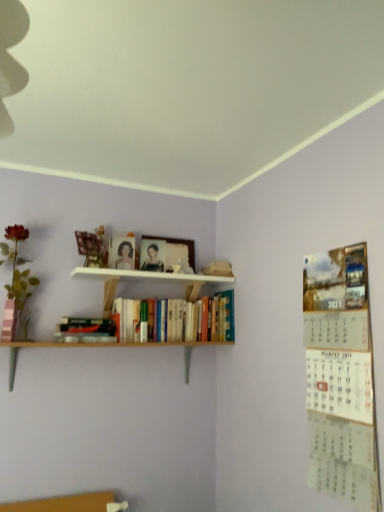
Measure the distance between metallic paper calendar at right and camera.

A distance of 1.25 meters exists between metallic paper calendar at right and camera.

Where is `metallic paper calendar at right`? The height and width of the screenshot is (512, 384). metallic paper calendar at right is located at coordinates (341, 376).

You are a GUI agent. You are given a task and a screenshot of the screen. Output one action in this format:
    pyautogui.click(x=<x>, y=<y>)
    Task: Click on the hardcover books at center, arranged as the 2th book when viewed from the left
    The image size is (384, 512).
    Given the screenshot: What is the action you would take?
    pyautogui.click(x=194, y=320)

Image resolution: width=384 pixels, height=512 pixels. What are the coordinates of `matte black portrait at center` in the screenshot? It's located at (153, 260).

Looking at this image, is wooden picture frame at upper center positioned with its back to matte black portrait at center?

No, wooden picture frame at upper center is not facing the opposite direction of matte black portrait at center.

How much distance is there between wooden picture frame at upper center and matte black portrait at center?

wooden picture frame at upper center is 5.78 inches from matte black portrait at center.

Choose the correct answer: Is wooden picture frame at upper center inside matte black portrait at center or outside it?

wooden picture frame at upper center is outside matte black portrait at center.

Considering the relative sizes of wooden picture frame at upper center and matte black portrait at center in the image provided, is wooden picture frame at upper center taller than matte black portrait at center?

Correct, wooden picture frame at upper center is much taller as matte black portrait at center.

Between matte black portrait at center and matte plastic rose at left, which one has larger size?

Bigger between the two is matte plastic rose at left.

Is matte black portrait at center facing towards matte plastic rose at left?

No, matte black portrait at center is not oriented towards matte plastic rose at left.

From the image's perspective, is matte black portrait at center above or below matte plastic rose at left?

matte black portrait at center is situated higher than matte plastic rose at left in the image.

How far apart are matte black portrait at center and matte plastic rose at left?

A distance of 58.28 centimeters exists between matte black portrait at center and matte plastic rose at left.

Which is in front, point (206, 337) or point (161, 269)?

The point (206, 337) is more forward.

From the image's perspective, is hardcover books at center, which is the first book in right-to-left order, positioned above or below matte black portrait at center?

Based on their image positions, hardcover books at center, which is the first book in right-to-left order, is located beneath matte black portrait at center.

Would you say hardcover books at center, which is the first book in right-to-left order, is to the left or to the right of matte black portrait at center in the picture?

Clearly, hardcover books at center, which is the first book in right-to-left order, is on the right of matte black portrait at center in the image.

Consider the image. What's the angular difference between hardcover books at center, arranged as the 2th book when viewed from the left, and matte black portrait at center's facing directions?

There is a 7.28-degree angle between the facing directions of hardcover books at center, arranged as the 2th book when viewed from the left, and matte black portrait at center.

Consider the image. Considering the relative sizes of matte black portrait at center and wooden picture frame at upper center in the image provided, is matte black portrait at center smaller than wooden picture frame at upper center?

Yes, matte black portrait at center is smaller than wooden picture frame at upper center.

In the scene shown: Relative to wooden picture frame at upper center, is matte black portrait at center in front or behind?

Visually, matte black portrait at center is located in front of wooden picture frame at upper center.

Is matte black portrait at center oriented towards wooden picture frame at upper center?

No, matte black portrait at center is not facing towards wooden picture frame at upper center.

Which object is wider, hardcover books at center, which is the first book in right-to-left order, or wooden picture frame at upper center?

With larger width is hardcover books at center, which is the first book in right-to-left order.

Based on the photo, is hardcover books at center, arranged as the 2th book when viewed from the left, placed right next to wooden picture frame at upper center?

No, hardcover books at center, arranged as the 2th book when viewed from the left, is not in contact with wooden picture frame at upper center.

Does point (214, 323) appear closer or farther from the camera than point (169, 238)?

Point (214, 323) appears to be closer to the viewer than point (169, 238).

Who is shorter, hardcover books at center, arranged as the 2th book when viewed from the left, or hardcover book at lower left, the first book in the left-to-right sequence?

hardcover book at lower left, the first book in the left-to-right sequence, is shorter.

Considering the positions of points (128, 325) and (67, 338), is point (128, 325) farther from camera compared to point (67, 338)?

Yes.

Identify the location of book located behind the hardcover book at lower left, the first book in the left-to-right sequence. The height and width of the screenshot is (512, 384). (x=194, y=320).

Is metallic paper calendar at right surrounding wooden picture frame at upper center?

No, wooden picture frame at upper center is located outside of metallic paper calendar at right.

From a real-world perspective, which is physically below, metallic paper calendar at right or wooden picture frame at upper center?

metallic paper calendar at right, from a real-world perspective.

Where is `bulletin board on the right side of wooden picture frame at upper center`? bulletin board on the right side of wooden picture frame at upper center is located at coordinates (341, 376).

Is metallic paper calendar at right taller or shorter than wooden picture frame at upper center?

In the image, metallic paper calendar at right appears to be taller than wooden picture frame at upper center.

The image size is (384, 512). I want to click on picture frame behind the matte black portrait at center, so click(178, 243).

Locate an element on the screen. flower that appears on the left of matte black portrait at center is located at coordinates (16, 266).

Looking at the image, which one is located further to matte plastic rose at left, metallic paper calendar at right or matte black portrait at center?

The object further to matte plastic rose at left is metallic paper calendar at right.

Which object lies nearer to the anchor point wooden picture frame at upper center, metallic paper calendar at right or hardcover books at center, arranged as the 2th book when viewed from the left?

hardcover books at center, arranged as the 2th book when viewed from the left, is closer to wooden picture frame at upper center.

Looking at the image, which one is located closer to hardcover books at center, arranged as the 2th book when viewed from the left, matte plastic rose at left or matte black portrait at center?

matte black portrait at center is positioned closer to the anchor hardcover books at center, arranged as the 2th book when viewed from the left.

Looking at the image, which one is located closer to wooden picture frame at upper center, hardcover book at lower left, the first book in the left-to-right sequence, or matte black portrait at center?

matte black portrait at center lies closer to wooden picture frame at upper center than the other object.

When comparing their distances from metallic paper calendar at right, does matte plastic rose at left or matte black portrait at center seem closer?

matte black portrait at center.

Estimate the real-world distances between objects in this image. Which object is closer to matte black portrait at center, metallic paper calendar at right or wooden picture frame at upper center?

The object closer to matte black portrait at center is wooden picture frame at upper center.

Based on the photo, when comparing their distances from matte plastic rose at left, does matte black portrait at center or hardcover books at center, which is the first book in right-to-left order, seem closer?

matte black portrait at center lies closer to matte plastic rose at left than the other object.

When comparing their distances from matte plastic rose at left, does hardcover book at lower left, the first book in the left-to-right sequence, or wooden picture frame at upper center seem closer?

hardcover book at lower left, the first book in the left-to-right sequence.

At what (x,y) coordinates should I click in order to perform the action: click on person between hardcover book at lower left, the second book viewed from the right, and metallic paper calendar at right from left to right. Please return your answer as a coordinate pair (x, y). Looking at the image, I should click on (153, 260).

Find the location of a particular element. person between matte plastic rose at left and hardcover books at center, arranged as the 2th book when viewed from the left, from left to right is located at coordinates (153, 260).

Image resolution: width=384 pixels, height=512 pixels. What are the coordinates of `book between matte plastic rose at left and wooden picture frame at upper center` in the screenshot? It's located at (89, 329).

What are the coordinates of `picture frame between hardcover book at lower left, the second book viewed from the right, and metallic paper calendar at right, in the horizontal direction` in the screenshot? It's located at (178, 243).